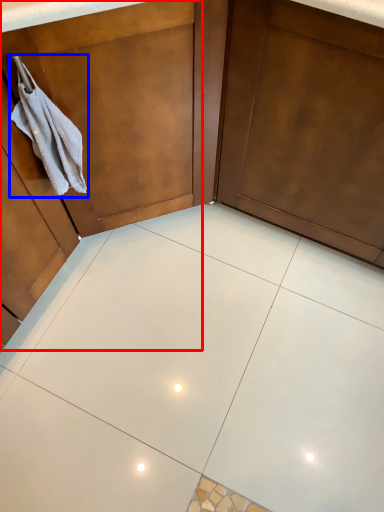
Question: Which object is closer to the camera taking this photo, dresser (highlighted by a red box) or hand towel (highlighted by a blue box)?

Choices:
 (A) dresser
 (B) hand towel

Answer: (A)